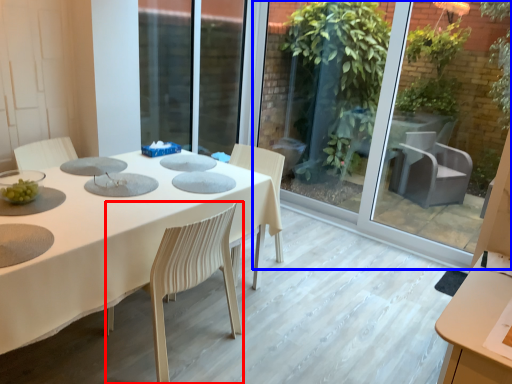
Question: Which object is further to the camera taking this photo, chair (highlighted by a red box) or glass door (highlighted by a blue box)?

Choices:
 (A) chair
 (B) glass door

Answer: (B)